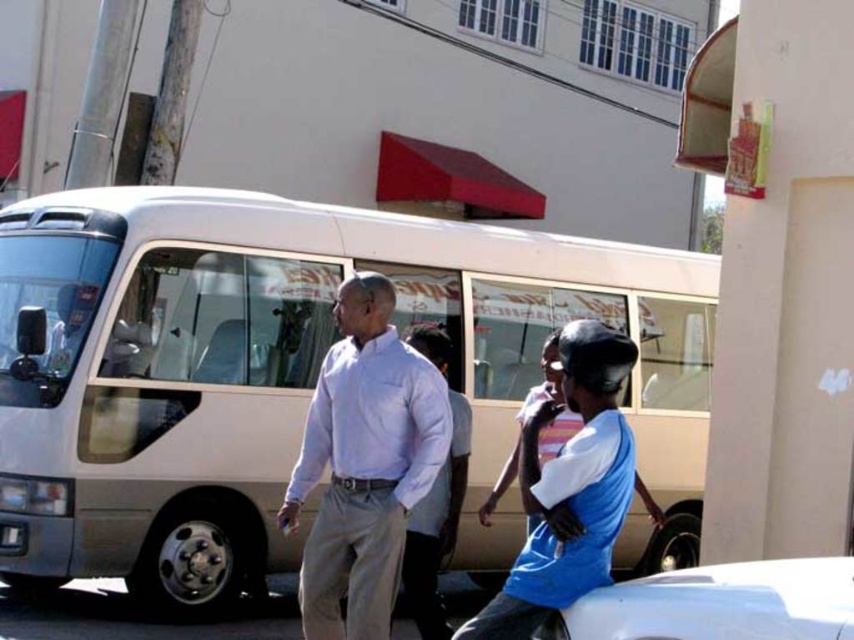
You are standing at the point where the camera is located. You want to find the blue fabric shirt at center. Which direction should you look to locate it?

The blue fabric shirt at center is located at point [568,486], so you should look towards the center of the image to locate it.

You are standing at the point closest to the camera in the scene. Which point, point (x=595, y=548) or point (x=847, y=616), is closer to your current position?

Point (x=595, y=548) is closer to your current position because it is further to the camera than point (x=847, y=616).

You are a photographer taking a picture of the beige minibus parked on the street. You notice two people in the foreground wearing the white cotton shirt at center and the blue fabric shirt at center. To ensure both shirts are fully visible in your photo, which shirt should you focus on first?

The white cotton shirt at center is taller than the blue fabric shirt at center, so focusing on the white cotton shirt at center first will ensure both shirts are fully visible in the photo.